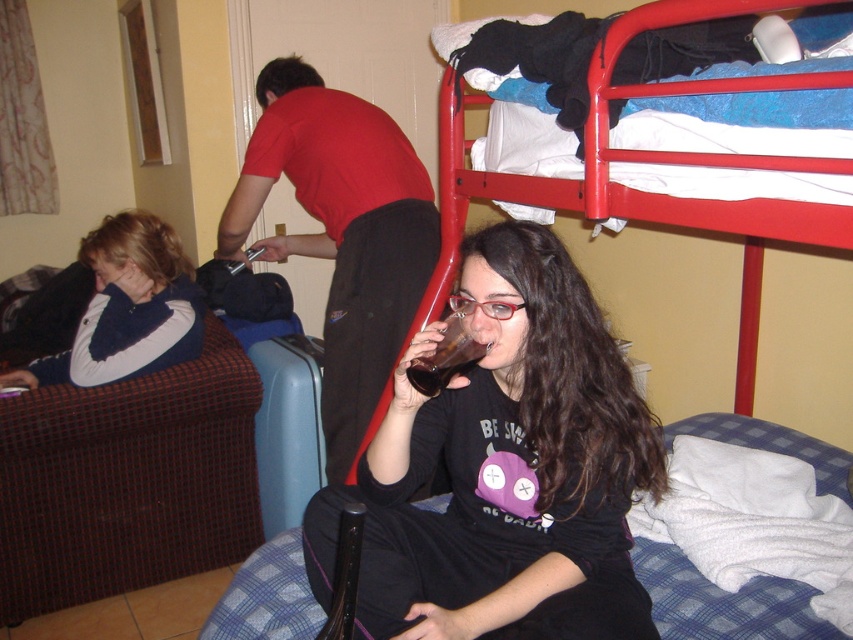
You are standing at the entrance of the hostel room and want to greet the person wearing the matte black shirt at center. Which direction should you walk to approach them?

The person wearing the matte black shirt at center is located at point 0.733 on the x axis and 0.593 on the y axis, so you should walk towards the center of the room to reach them.

You are a traveler with a blue fleece jacket at left and a translucent glass at center in your hostel room. You want to place both items on a narrow shelf that can only hold one item at a time. Which item should you place first to avoid knocking over the other?

The blue fleece jacket at left is wider than the translucent glass at center, so place the jacket first to prevent it from knocking over the glass when placing the second item.